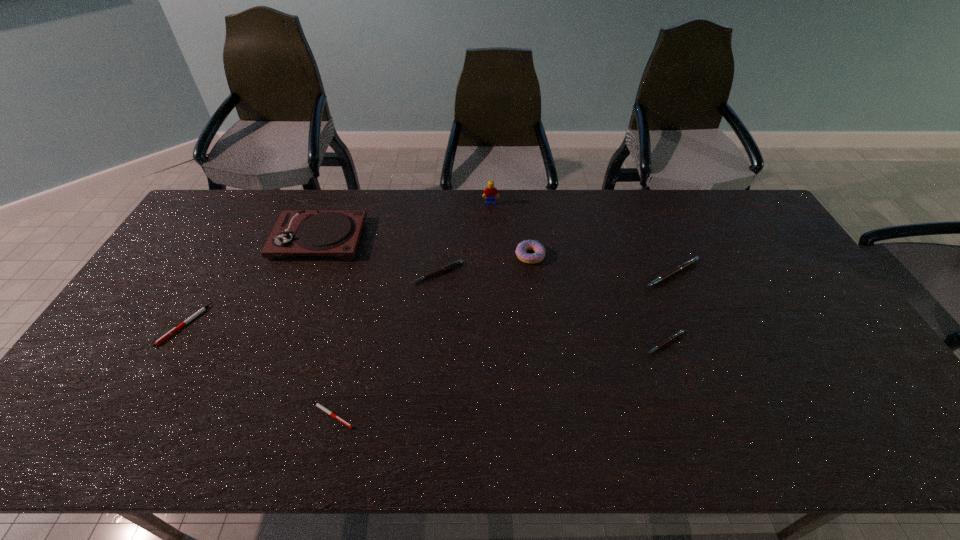
Locate an element on the screen. Image resolution: width=960 pixels, height=540 pixels. the farthest object is located at coordinates (490, 192).

Where is `Lego`? Lego is located at coordinates (490, 192).

At what (x,y) coordinates should I click in order to perform the action: click on the second tallest object. Please return your answer as a coordinate pair (x, y). This screenshot has width=960, height=540. Looking at the image, I should click on click(x=337, y=233).

This screenshot has width=960, height=540. Identify the location of the third tallest object. (538, 248).

Identify the location of purple doughnut. (538, 248).

This screenshot has width=960, height=540. What are the coordinates of `the tallest pen` in the screenshot? It's located at (684, 265).

The height and width of the screenshot is (540, 960). In order to click on the fourth tallest object in this screenshot , I will do `click(684, 265)`.

Where is `the second biggest pink pen`? the second biggest pink pen is located at coordinates (454, 264).

Where is `the fifth tallest object`? the fifth tallest object is located at coordinates (454, 264).

The height and width of the screenshot is (540, 960). I want to click on the nearest pink pen, so click(669, 339).